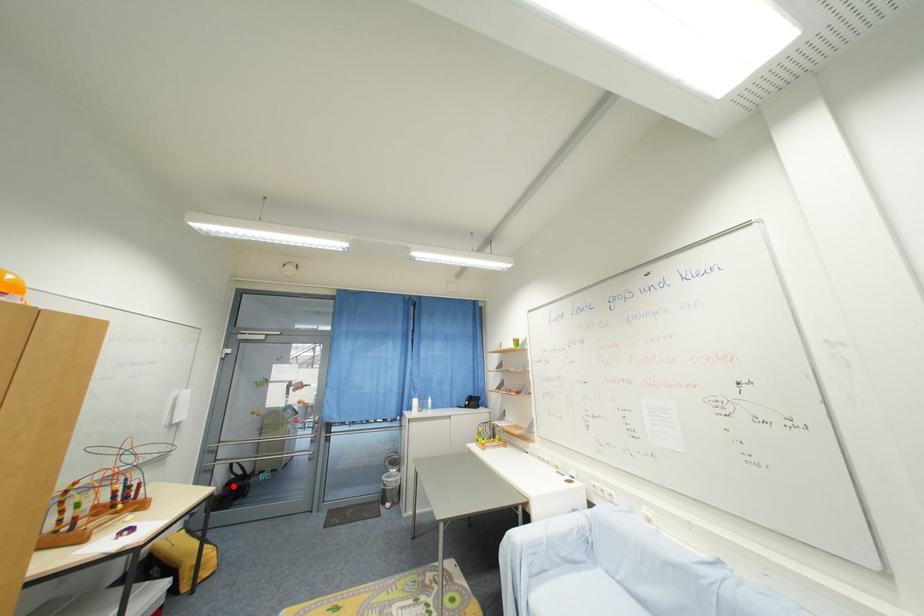
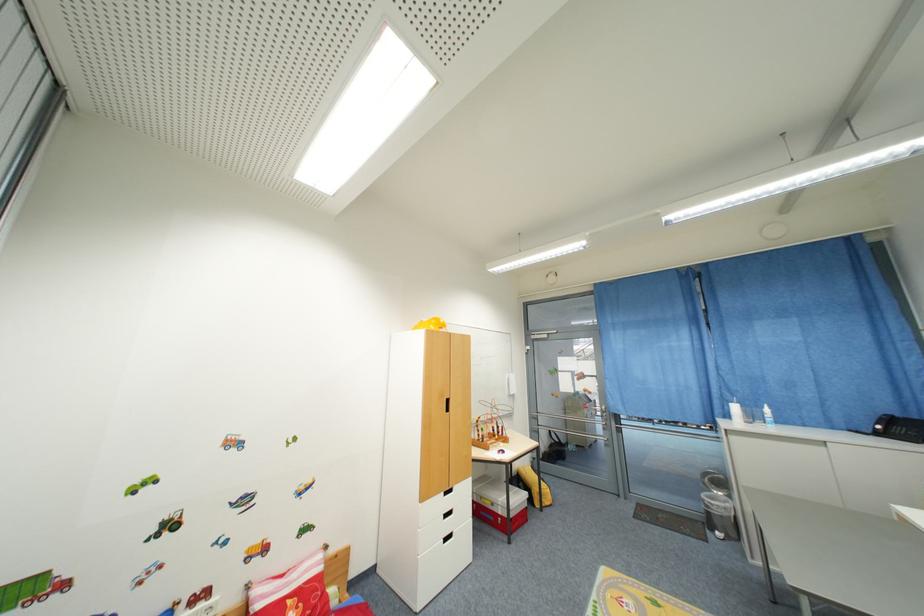
Question: I am providing you with two images of the same scene from different viewpoints. A red point is marked on the first image. At the location where the point appears in image 1, is it still visible in image 2?

Choices:
 (A) Yes
 (B) No

Answer: (A)